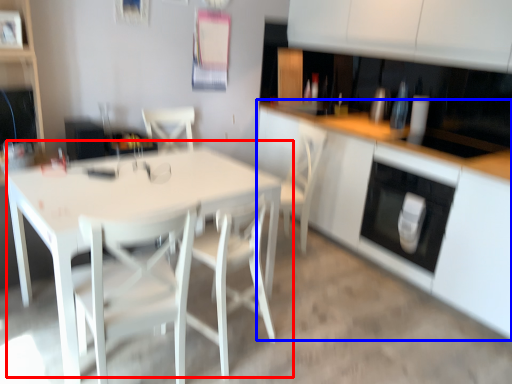
Question: Which object appears farthest to the camera in this image, table (highlighted by a red box) or cabinetry (highlighted by a blue box)?

Choices:
 (A) table
 (B) cabinetry

Answer: (B)